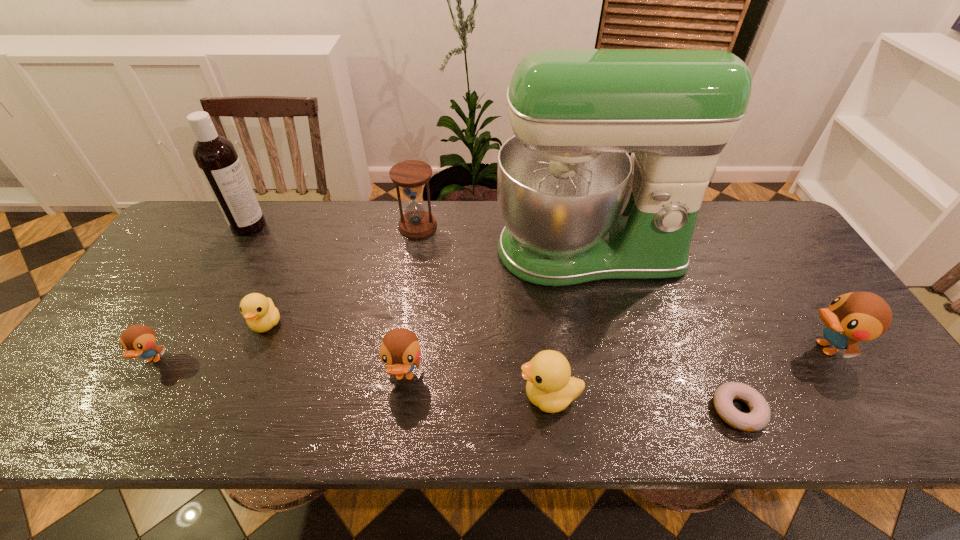
I want to click on free space located on the front-facing side of the biggest blue duck, so click(731, 347).

Identify the location of free space located on the front-facing side of the biggest blue duck. click(685, 347).

Identify the location of free location located on the face of the bigger yellow duck. (451, 396).

The image size is (960, 540). What are the coordinates of `free spot located 0.130m on the face of the bigger yellow duck` in the screenshot? It's located at (460, 396).

Locate an element on the screen. This screenshot has width=960, height=540. vacant space situated on the face of the bigger yellow duck is located at coordinates (348, 396).

Locate an element on the screen. This screenshot has height=540, width=960. vacant space situated on the front-facing side of the leftmost duck is located at coordinates (108, 433).

Locate an element on the screen. The height and width of the screenshot is (540, 960). free region located on the face of the third object from left to right is located at coordinates (232, 403).

You are a GUI agent. You are given a task and a screenshot of the screen. Output one action in this format:
    pyautogui.click(x=<x>, y=<y>)
    Task: Click on the free space located 0.150m on the right of the shortest object
    
    Given the screenshot: What is the action you would take?
    pyautogui.click(x=831, y=410)

Identify the location of mixer that is at the far edge. (577, 208).

Locate an element on the screen. The width and height of the screenshot is (960, 540). dishwasher detergent located in the far edge section of the desktop is located at coordinates (216, 157).